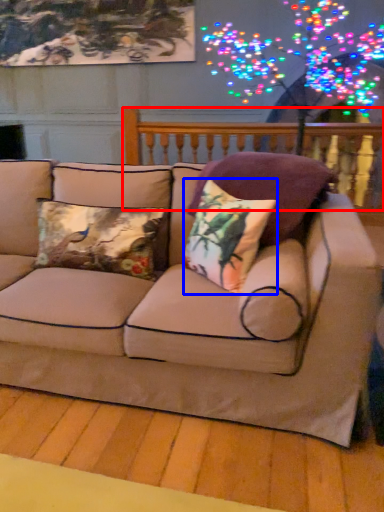
Question: Which object is further to the camera taking this photo, balustrade (highlighted by a red box) or pillow (highlighted by a blue box)?

Choices:
 (A) balustrade
 (B) pillow

Answer: (A)